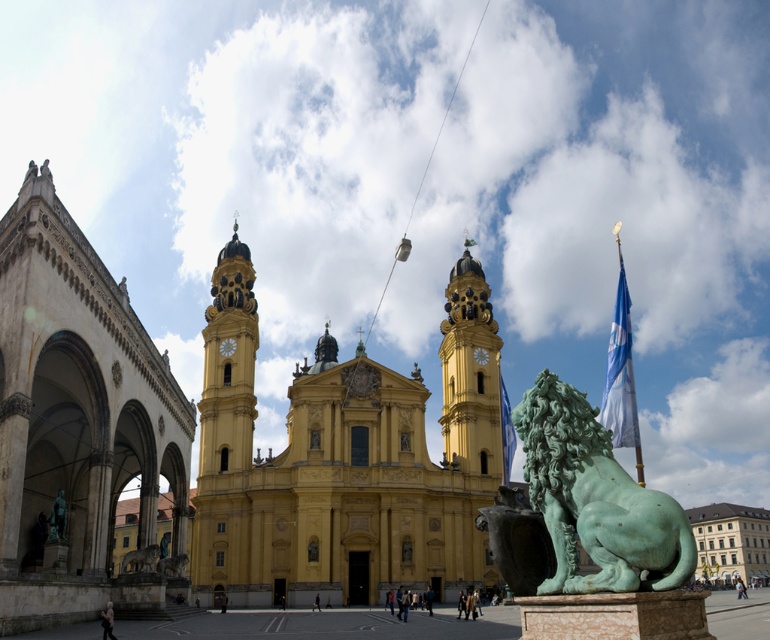
In the scene shown: Is yellow stone church at center below green patina lion at lower right?

No, yellow stone church at center is not below green patina lion at lower right.

Who is more forward, [340,552] or [548,509]?

Positioned in front is point [548,509].

This screenshot has height=640, width=770. Identify the location of yellow stone church at center. (343, 460).